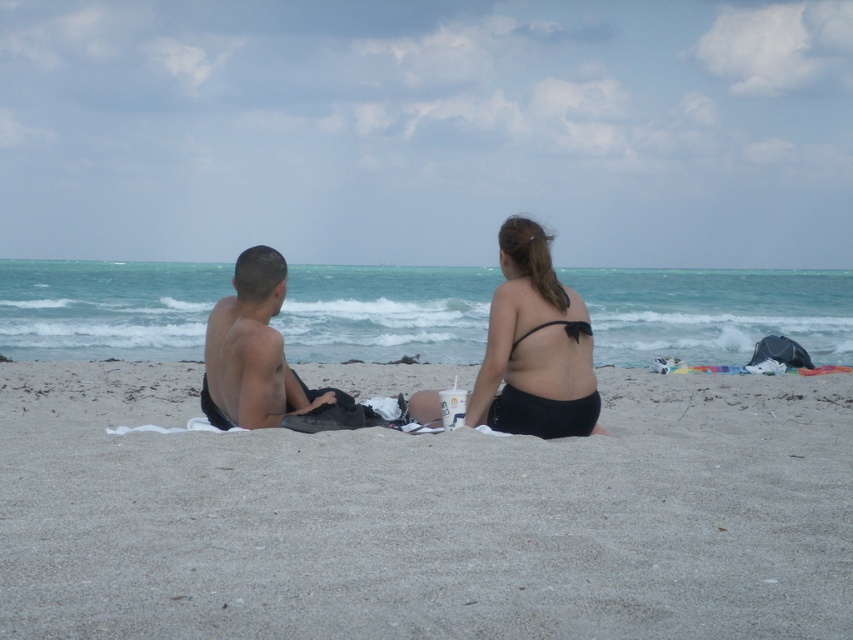
Is the position of matte black bikini at center less distant than that of black matte bikini at center?

No, matte black bikini at center is behind black matte bikini at center.

Is point (593, 392) closer to viewer compared to point (578, 326)?

No, it is not.

I want to click on matte black bikini at center, so click(532, 346).

Which is above, matte black towel at left or black matte bikini top at center?

Positioned higher is matte black towel at left.

At what (x,y) coordinates should I click in order to perform the action: click on matte black towel at left. Please return your answer as a coordinate pair (x, y). The width and height of the screenshot is (853, 640). Looking at the image, I should click on (253, 352).

Is smooth sand at center shorter than black matte bikini at center?

Indeed, smooth sand at center has a lesser height compared to black matte bikini at center.

Measure the distance between smooth sand at center and camera.

They are 10.61 feet apart.

The width and height of the screenshot is (853, 640). What do you see at coordinates (425, 516) in the screenshot?
I see `smooth sand at center` at bounding box center [425, 516].

Identify the location of smooth sand at center. This screenshot has width=853, height=640. (425, 516).